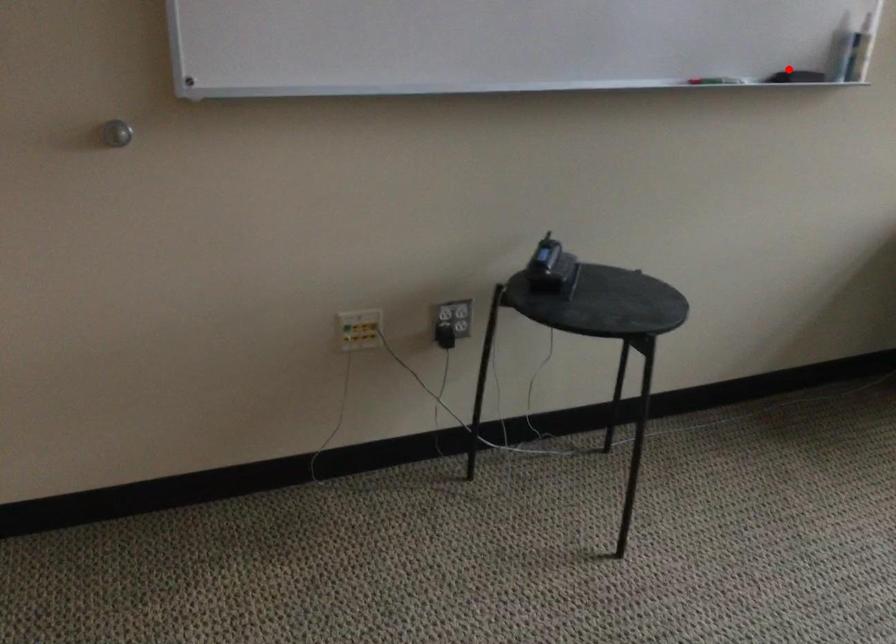
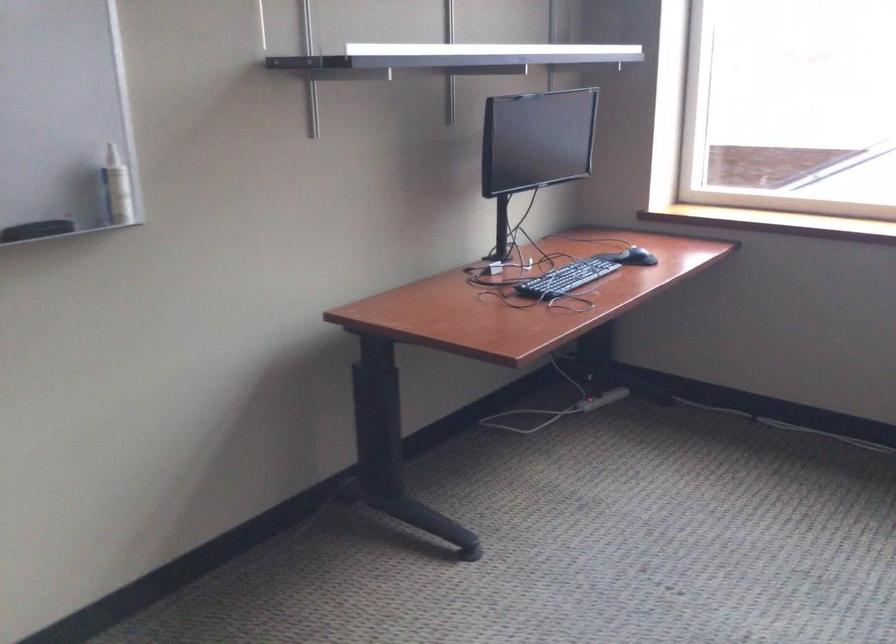
Find the pixel in the second image that matches the highlighted location in the first image.

(36, 230)